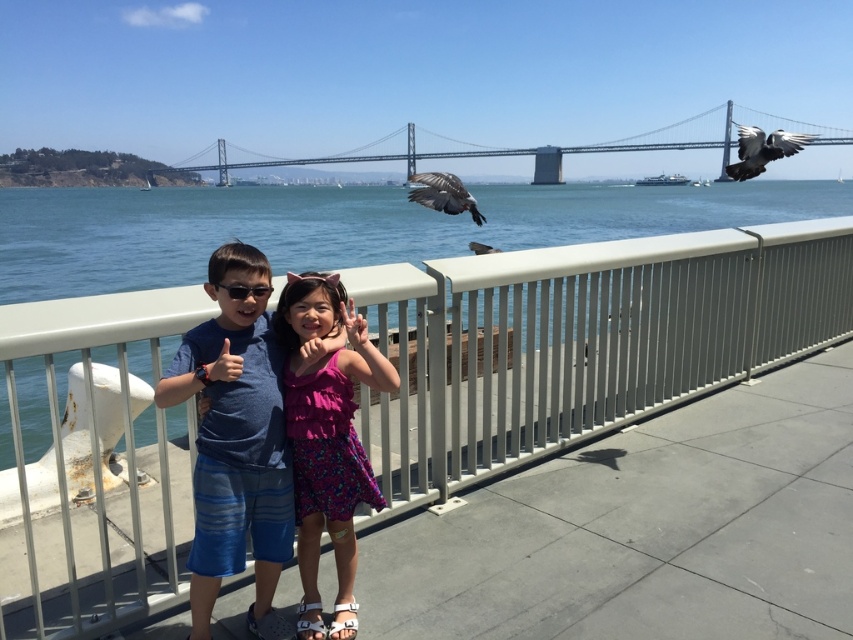
Question: Which point is farther from the camera taking this photo?

Choices:
 (A) (271, 289)
 (B) (286, 552)
 (C) (749, 164)

Answer: (C)

Question: Does white metal railing at center have a smaller size compared to black plastic sunglasses at center?

Choices:
 (A) no
 (B) yes

Answer: (A)

Question: Does blue striped shorts at center have a lesser width compared to pink floral dress at center?

Choices:
 (A) yes
 (B) no

Answer: (A)

Question: Estimate the real-world distances between objects in this image. Which object is farther from the metallic gray bridge at upper center?

Choices:
 (A) gray feathered bird at center
 (B) gray feathered bird at upper right
 (C) black plastic sunglasses at center
 (D) blue striped shorts at center

Answer: (B)

Question: Which of the following is the farthest from the observer?

Choices:
 (A) blue striped shorts at center
 (B) metallic gray bridge at upper center

Answer: (B)

Question: Is white metal railing at center bigger than blue striped shorts at center?

Choices:
 (A) no
 (B) yes

Answer: (A)